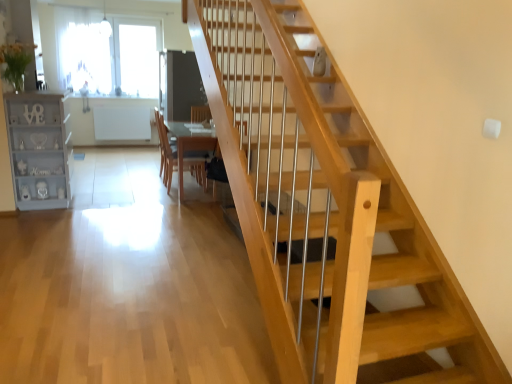
Question: In terms of size, does light gray painted wood bookshelf at left appear bigger or smaller than transparent glass window at upper left?

Choices:
 (A) small
 (B) big

Answer: (B)

Question: From a real-world perspective, is light gray painted wood bookshelf at left physically located above or below transparent glass window at upper left?

Choices:
 (A) above
 (B) below

Answer: (B)

Question: Which object is positioned closest to the transparent glass window at upper left?

Choices:
 (A) light gray painted wood bookshelf at left
 (B) wooden at center

Answer: (B)

Question: Which is farther from the transparent glass window at upper left?

Choices:
 (A) light gray painted wood bookshelf at left
 (B) wooden at center

Answer: (A)